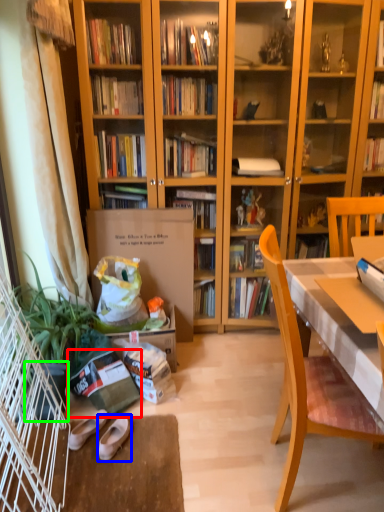
Question: Considering the real-world distances, which object is closest to paperback book (highlighted by a red box)? footwear (highlighted by a blue box) or flowerpot (highlighted by a green box).

Choices:
 (A) footwear
 (B) flowerpot

Answer: (B)